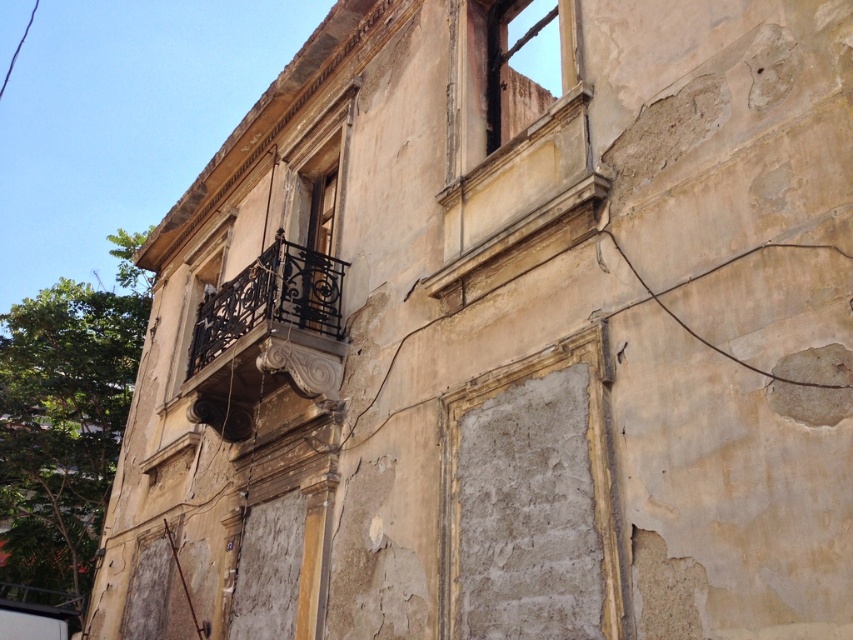
Based on the photo, you are standing in front of the old building and want to reach the rusty metal window at upper center. Which direction should you move relative to the black wrought iron balcony at center?

The black wrought iron balcony at center is to the left of the rusty metal window at upper center, so to reach the rusty metal window at upper center, you should move to the right relative to the black wrought iron balcony at center.

You are standing in front of the old building and want to place a potted plant on the balcony. Can you place the plant on the black wrought iron balcony at center without it being directly under the rusty metal window at upper center?

The black wrought iron balcony at center is positioned under the rusty metal window at upper center, so placing the plant there would place it directly under the window. Choose another location to avoid placing it under the window.